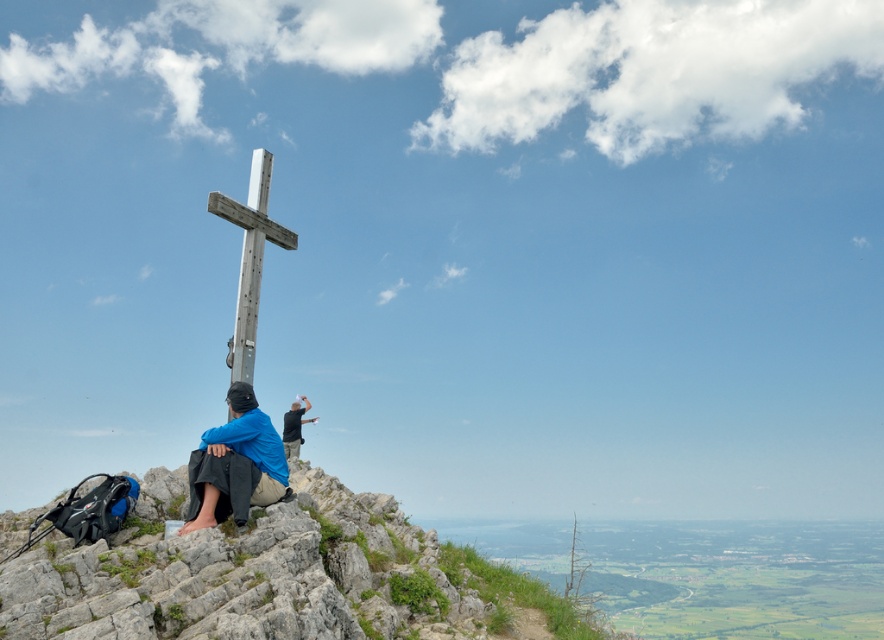
Question: Can you confirm if gray rocky hillside at lower left is positioned above metallic silver cross at center?

Choices:
 (A) no
 (B) yes

Answer: (A)

Question: Which point is closer to the camera?

Choices:
 (A) blue fabric pants at lower left
 (B) gray rocky hillside at lower left
 (C) metallic silver cross at center

Answer: (B)

Question: Can you confirm if gray rocky hillside at lower left is positioned to the right of blue fabric pants at lower left?

Choices:
 (A) no
 (B) yes

Answer: (B)

Question: Which object appears closest to the camera in this image?

Choices:
 (A) gray rocky hillside at lower left
 (B) blue fabric pants at lower left

Answer: (A)

Question: Does gray rocky hillside at lower left appear over metallic silver cross at center?

Choices:
 (A) no
 (B) yes

Answer: (A)

Question: Which point is closer to the camera?

Choices:
 (A) gray rocky hillside at lower left
 (B) metallic silver cross at center

Answer: (A)